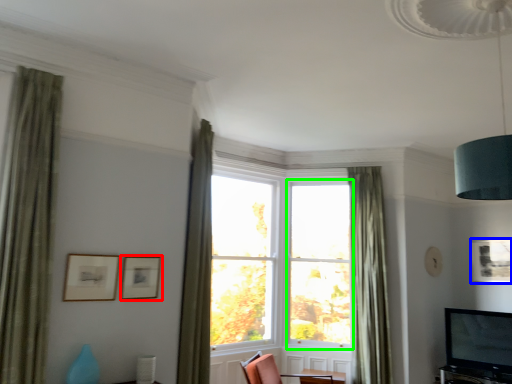
Question: Estimate the real-world distances between objects in this image. Which object is closer to picture frame (highlighted by a red box), picture frame (highlighted by a blue box) or window frame (highlighted by a green box)?

Choices:
 (A) picture frame
 (B) window frame

Answer: (B)